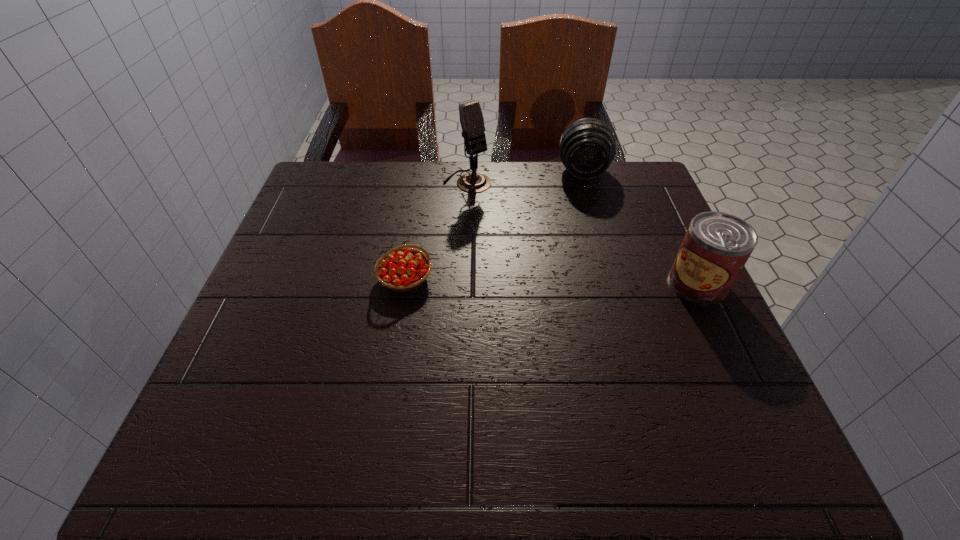
Find the location of `free region at the near edge of the desktop`. free region at the near edge of the desktop is located at coordinates (641, 404).

In order to click on free space at the left edge in this screenshot , I will do `click(337, 272)`.

Image resolution: width=960 pixels, height=540 pixels. I want to click on free space at the right edge, so click(633, 250).

You are a GUI agent. You are given a task and a screenshot of the screen. Output one action in this format:
    pyautogui.click(x=<x>, y=<y>)
    Task: Click on the free space at the far left corner of the desktop
    
    Given the screenshot: What is the action you would take?
    pyautogui.click(x=353, y=201)

I want to click on vacant space at the near left corner of the desktop, so click(237, 388).

This screenshot has height=540, width=960. In the image, there is a desktop. What are the coordinates of `vacant space at the far right corner` in the screenshot? It's located at (640, 168).

The image size is (960, 540). In order to click on vacant area between the third object from left to right and the tallest object in this screenshot , I will do pyautogui.click(x=525, y=177).

Identify the location of unoccupied area between the microphone and the can. The height and width of the screenshot is (540, 960). (583, 233).

This screenshot has width=960, height=540. I want to click on empty location between the second object from right to left and the leftmost object, so click(x=494, y=226).

Find the location of a particular element. vacant area that lies between the leftmost object and the can is located at coordinates (551, 281).